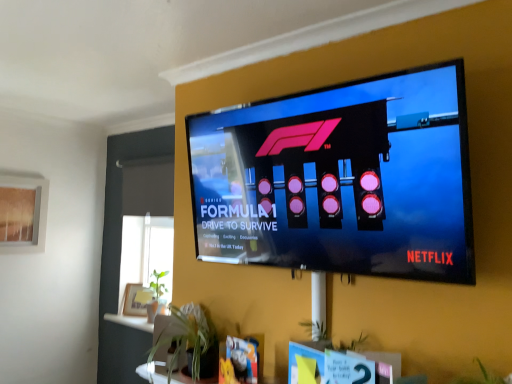
Question: Considering the relative sizes of green leafy plant at lower center and translucent glass window screen at upper left in the image provided, is green leafy plant at lower center shorter than translucent glass window screen at upper left?

Choices:
 (A) no
 (B) yes

Answer: (B)

Question: Is green leafy plant at lower center thinner than translucent glass window screen at upper left?

Choices:
 (A) no
 (B) yes

Answer: (A)

Question: Considering the relative sizes of green leafy plant at lower center and translucent glass window screen at upper left in the image provided, is green leafy plant at lower center wider than translucent glass window screen at upper left?

Choices:
 (A) no
 (B) yes

Answer: (B)

Question: Does green leafy plant at lower center contain translucent glass window screen at upper left?

Choices:
 (A) no
 (B) yes

Answer: (A)

Question: Is green leafy plant at lower center with translucent glass window screen at upper left?

Choices:
 (A) no
 (B) yes

Answer: (A)

Question: Is black glossy tv at upper center in front of or behind green leafy plant at lower center in the image?

Choices:
 (A) front
 (B) behind

Answer: (A)

Question: From a real-world perspective, relative to green leafy plant at lower center, is black glossy tv at upper center vertically above or below?

Choices:
 (A) below
 (B) above

Answer: (B)

Question: Is point (416, 188) positioned closer to the camera than point (206, 347)?

Choices:
 (A) farther
 (B) closer

Answer: (B)

Question: From the image's perspective, is black glossy tv at upper center located above or below green leafy plant at lower center?

Choices:
 (A) below
 (B) above

Answer: (B)

Question: Is black glossy tv at upper center wider or thinner than translucent glass window screen at upper left?

Choices:
 (A) thin
 (B) wide

Answer: (B)

Question: From the image's perspective, is black glossy tv at upper center located above or below translucent glass window screen at upper left?

Choices:
 (A) above
 (B) below

Answer: (A)

Question: Based on their sizes in the image, would you say black glossy tv at upper center is bigger or smaller than translucent glass window screen at upper left?

Choices:
 (A) small
 (B) big

Answer: (B)

Question: From a real-world perspective, is black glossy tv at upper center physically located above or below translucent glass window screen at upper left?

Choices:
 (A) below
 (B) above

Answer: (B)

Question: Looking at the image, does translucent glass window screen at upper left seem bigger or smaller compared to green leafy plant at lower center?

Choices:
 (A) small
 (B) big

Answer: (B)

Question: Is translucent glass window screen at upper left taller or shorter than green leafy plant at lower center?

Choices:
 (A) short
 (B) tall

Answer: (B)